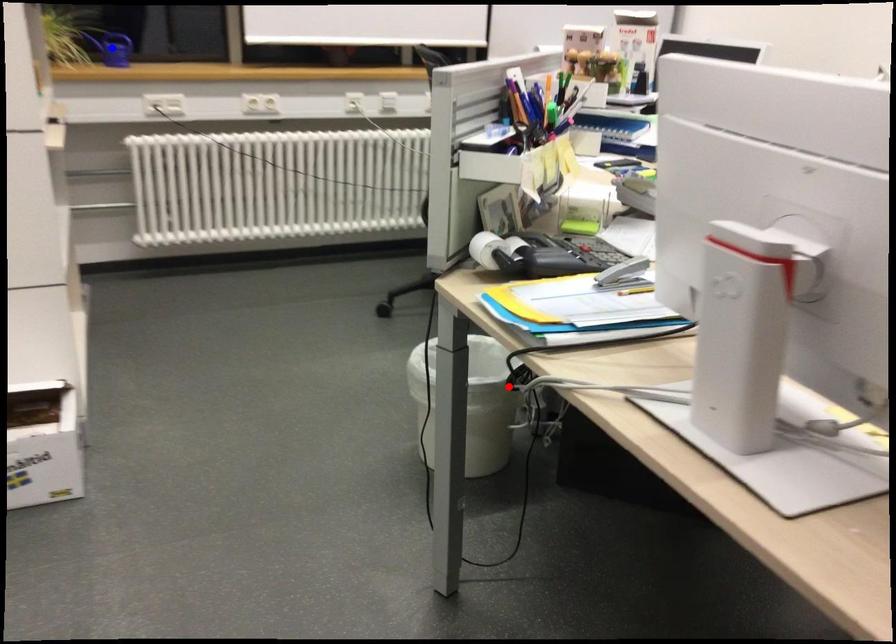
Question: In the image, two points are highlighted. Which point is nearer to the camera? Reply with the corresponding letter.

Choices:
 (A) blue point
 (B) red point

Answer: (B)